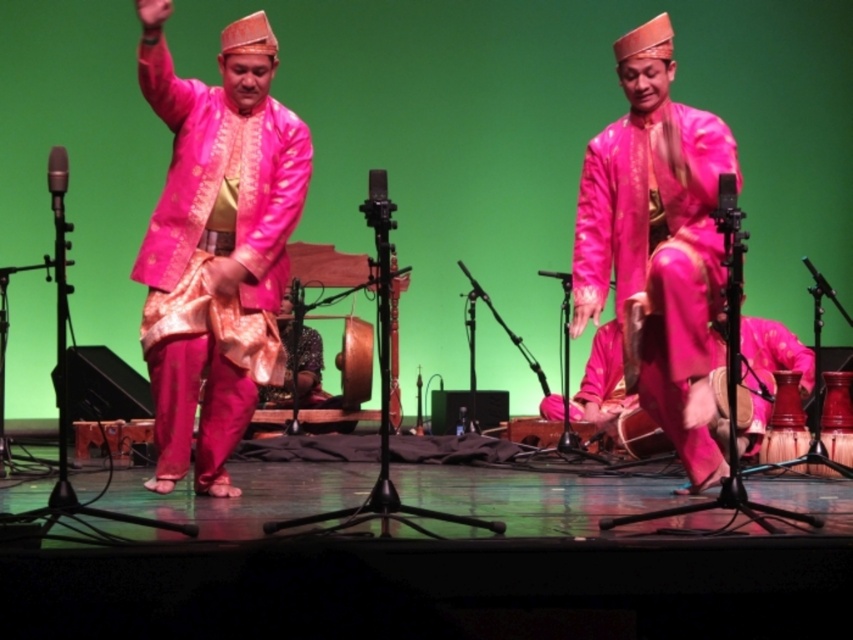
You are a photographer positioned at the back of the stage. You want to capture a closeup shot of the matte pink silk outfit at center. Considering the distance, can you achieve this without moving closer?

The matte pink silk outfit at center is 14.60 feet away from the camera. A professional camera with a zoom lens can capture a closeup shot from this distance without needing to move closer.

You are a stagehand preparing to adjust the lighting for the performance. You need to ensure that the spotlight reaches both the matte pink fabric at center and the silky pink fabric at center. Which fabric should you focus the spotlight on first if you want to illuminate the taller one first?

The matte pink fabric at center is taller than the silky pink fabric at center, so you should focus the spotlight on the matte pink fabric at center first to illuminate the taller one.